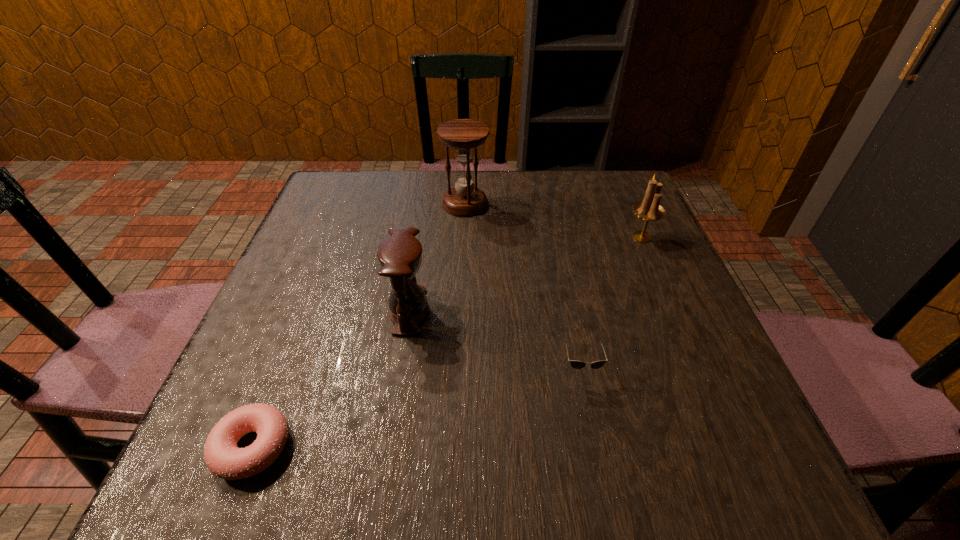
This screenshot has height=540, width=960. What are the coordinates of `empty space between the tallest object and the fourth object from right to left` in the screenshot? It's located at (437, 258).

Locate an element on the screen. vacant area that lies between the fourth farthest object and the farthest object is located at coordinates (523, 286).

The height and width of the screenshot is (540, 960). What are the coordinates of `unoccupied position between the candle holder and the second nearest object` in the screenshot? It's located at (612, 303).

Where is `blank region between the sunglasses and the fourth nearest object`? The image size is (960, 540). blank region between the sunglasses and the fourth nearest object is located at coordinates (x=612, y=303).

Locate an element on the screen. blank region between the farther hourglass and the leftmost object is located at coordinates (359, 325).

At what (x,y) coordinates should I click in order to perform the action: click on vacant area between the shorter hourglass and the candle holder. Please return your answer as a coordinate pair (x, y). Image resolution: width=960 pixels, height=540 pixels. Looking at the image, I should click on (525, 274).

I want to click on object that is the second closest one to the second object from left to right, so click(576, 364).

You are a GUI agent. You are given a task and a screenshot of the screen. Output one action in this format:
    pyautogui.click(x=<x>, y=<y>)
    Task: Click on the object that is the third closest one to the second object from right to left
    Image resolution: width=960 pixels, height=540 pixels.
    Given the screenshot: What is the action you would take?
    pyautogui.click(x=225, y=460)

Locate an element on the screen. This screenshot has height=540, width=960. free space that satisfies the following two spatial constraints: 1. on the back side of the shorter hourglass; 2. on the left side of the second farthest object is located at coordinates (420, 237).

Where is `vacant space that satisfies the following two spatial constraints: 1. on the back side of the right hourglass; 2. on the left side of the shortest object`? The height and width of the screenshot is (540, 960). vacant space that satisfies the following two spatial constraints: 1. on the back side of the right hourglass; 2. on the left side of the shortest object is located at coordinates (348, 204).